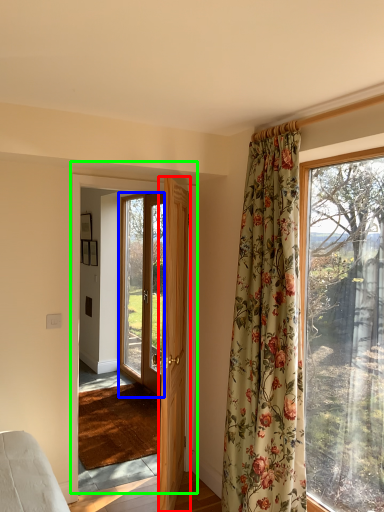
Question: Estimate the real-world distances between objects in this image. Which object is closer to door (highlighted by a red box), door (highlighted by a blue box) or door (highlighted by a green box)?

Choices:
 (A) door
 (B) door

Answer: (B)